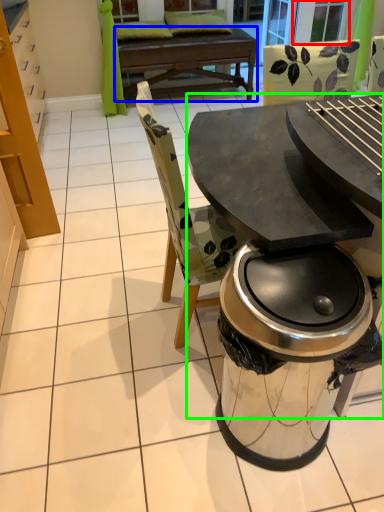
Question: Estimate the real-world distances between objects in this image. Which object is farther from screen door (highlighted by a red box), round table (highlighted by a blue box) or table (highlighted by a green box)?

Choices:
 (A) round table
 (B) table

Answer: (B)